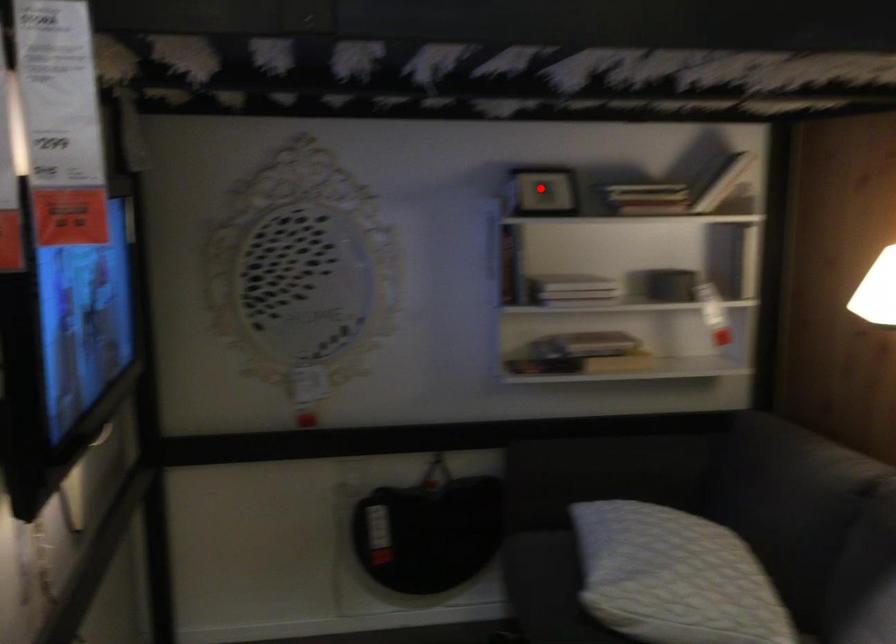
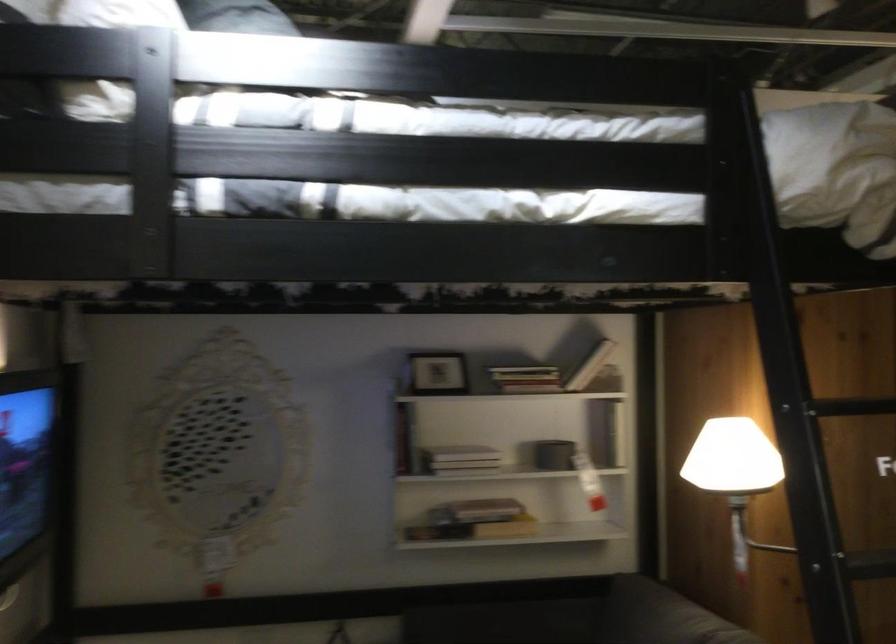
In the second image, find the point that corresponds to the highlighted location in the first image.

(437, 373)